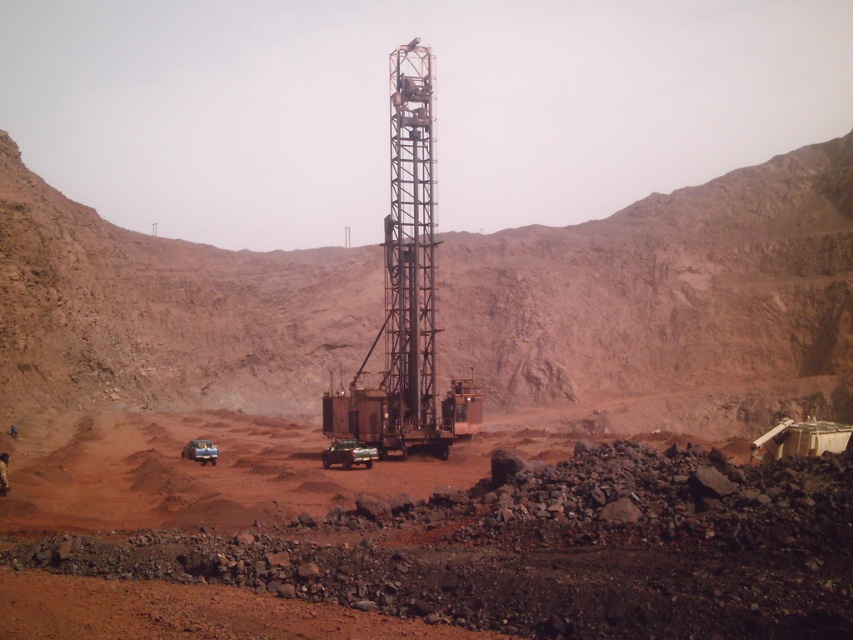
Question: Based on their relative distances, which object is nearer to the dusty red soil at center?

Choices:
 (A) metallic silver truck at center
 (B) metallic silver truck at lower left
 (C) rusty metal drilling rig at center

Answer: (A)

Question: Does rustic metal drilling rig at center have a greater width compared to metallic silver truck at lower left?

Choices:
 (A) yes
 (B) no

Answer: (A)

Question: Which point is closer to the camera?

Choices:
 (A) rustic metal drilling rig at center
 (B) metallic silver truck at center
 (C) dusty red soil at center

Answer: (C)

Question: Is rustic metal drilling rig at center positioned behind rusty metal drilling rig at center?

Choices:
 (A) yes
 (B) no

Answer: (A)

Question: Observing the image, what is the correct spatial positioning of rusty metal drilling rig at center in reference to metallic silver truck at center?

Choices:
 (A) below
 (B) above

Answer: (B)

Question: Which is farther from the rustic metal drilling rig at center?

Choices:
 (A) metallic silver truck at center
 (B) rusty metal drilling rig at center
 (C) dusty red soil at center

Answer: (A)